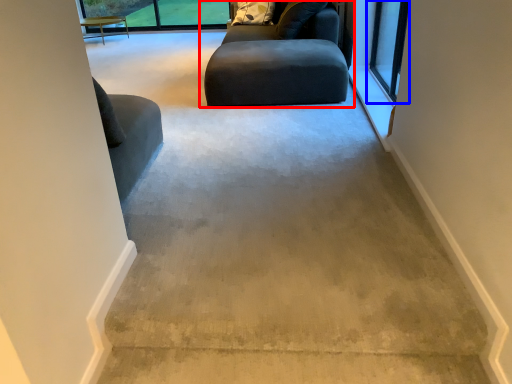
Question: Among these objects, which one is farthest to the camera, studio couch (highlighted by a red box) or window (highlighted by a blue box)?

Choices:
 (A) studio couch
 (B) window

Answer: (A)